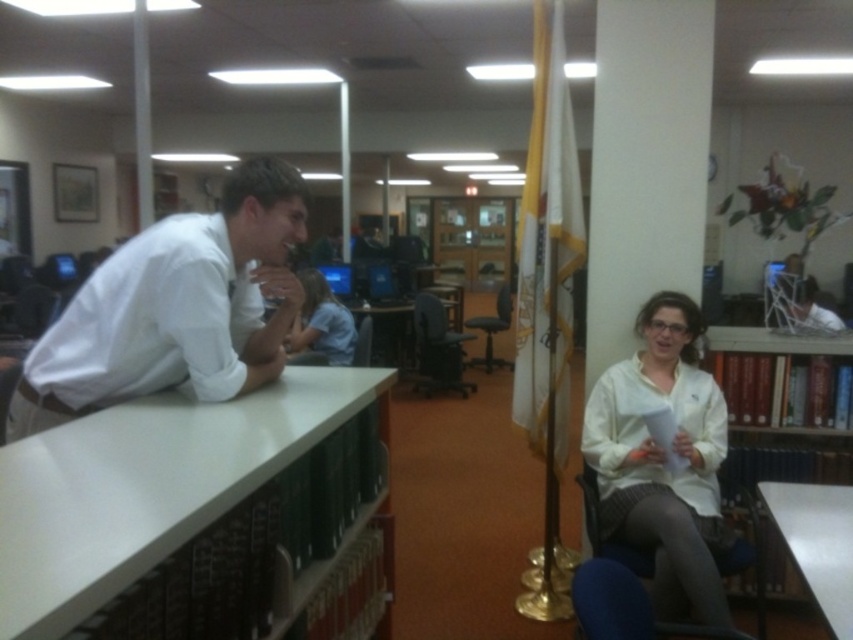
What is located at the coordinates point [177,307] in the image?

The white smooth shirt at left is located at point [177,307].